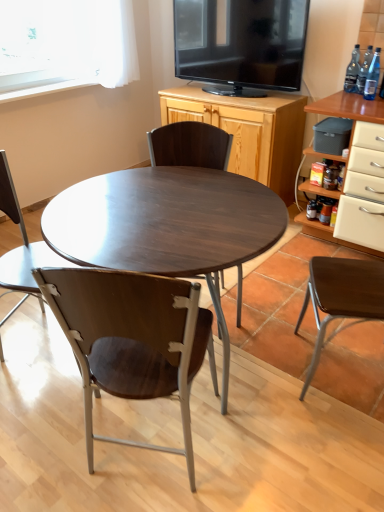
The image size is (384, 512). Find the location of `free space above dark wood/finish coffee table at center (from a real-world perspective)`. free space above dark wood/finish coffee table at center (from a real-world perspective) is located at coordinates [x=166, y=201].